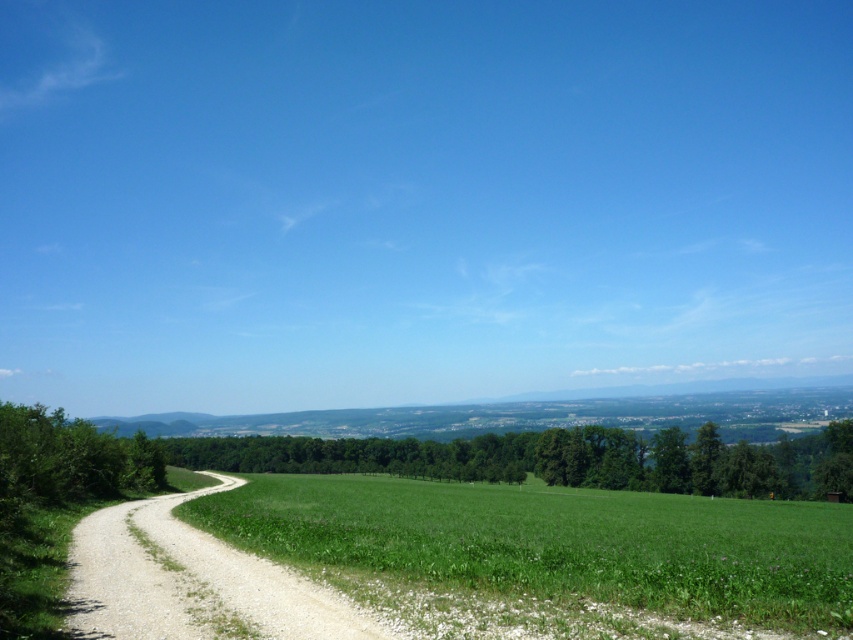
You are a hiker standing on the dirt path in the foreground. You want to walk straight ahead towards the horizon. Which object, the green grass at center or the green leafy tree at left, will you encounter first?

The green grass at center will be encountered first because it is closer to the viewer than the green leafy tree at left.

You are standing at the point labeled as point (558, 541) in the image. What is the color of the ground beneath your feet?

The ground beneath your feet at point (558, 541) is green grass.

You are standing at the edge of the dirt path in the rural landscape. You want to walk straight towards the green leafy trees at center. How far will you have to walk to reach them?

The green leafy trees at center are 239.28 feet away from the viewer, so you will have to walk 239.28 feet to reach them.